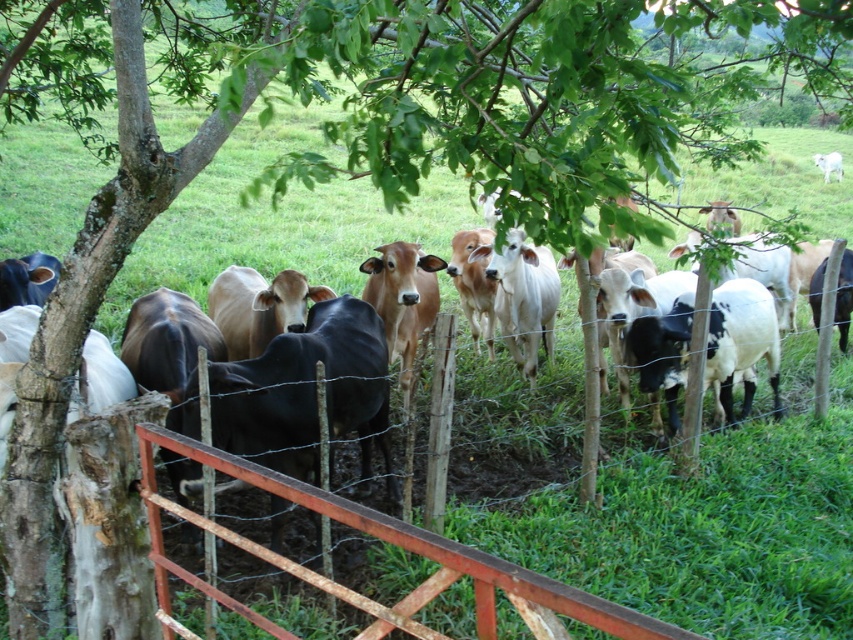
Question: Which point appears farthest from the camera in this image?

Choices:
 (A) (714, 323)
 (B) (819, 156)

Answer: (B)

Question: Observing the image, what is the correct spatial positioning of black and white spotted cow at center in reference to white glossy cow at upper right?

Choices:
 (A) below
 (B) above

Answer: (A)

Question: Considering the relative positions of black and white spotted cow at center and white glossy cow at upper right in the image provided, where is black and white spotted cow at center located with respect to white glossy cow at upper right?

Choices:
 (A) left
 (B) right

Answer: (A)

Question: Does black and white spotted cow at center have a smaller size compared to white glossy cow at upper right?

Choices:
 (A) no
 (B) yes

Answer: (A)

Question: Among these points, which one is nearest to the camera?

Choices:
 (A) (827, 161)
 (B) (630, 330)

Answer: (B)

Question: Among these objects, which one is farthest from the camera?

Choices:
 (A) white glossy cow at upper right
 (B) black and white spotted cow at center

Answer: (A)